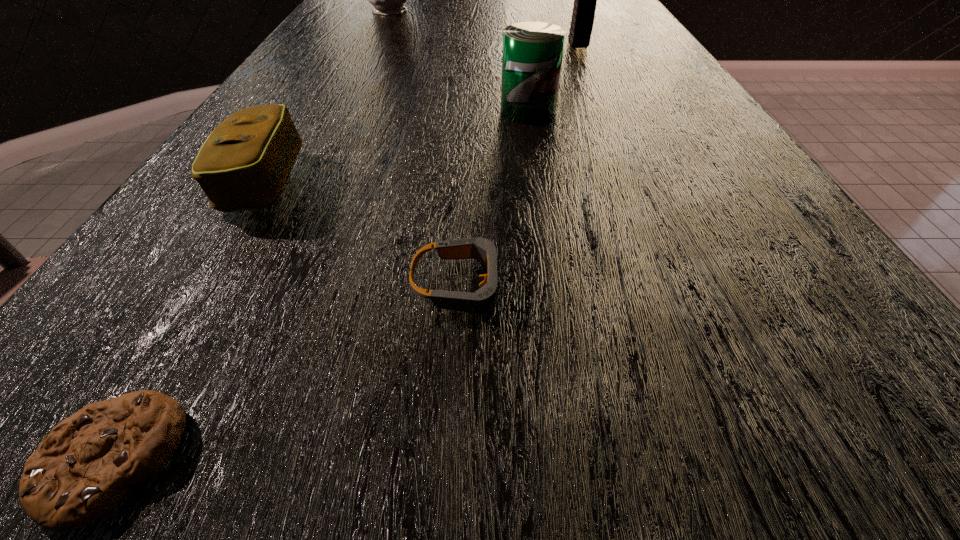
What are the coordinates of `free space between the shorter clutch bag and the rightmost object` in the screenshot? It's located at (421, 113).

Choose which object is the fifth nearest neighbor to the goggles. Please provide its 2D coordinates. Your answer should be formatted as a tuple, i.e. [(x, y)], where the tuple contains the x and y coordinates of a point satisfying the conditions above.

[(387, 0)]

Image resolution: width=960 pixels, height=540 pixels. I want to click on the second closest object to the second nearest object, so pos(244,164).

Where is `free space that satisfies the following two spatial constraints: 1. on the front side of the second object from right to left; 2. on the zipper side of the nearer clutch bag`? The height and width of the screenshot is (540, 960). free space that satisfies the following two spatial constraints: 1. on the front side of the second object from right to left; 2. on the zipper side of the nearer clutch bag is located at coordinates (540, 182).

Image resolution: width=960 pixels, height=540 pixels. What are the coordinates of `free region that satisfies the following two spatial constraints: 1. with the zip open on the rightmost object; 2. on the zipper side of the third nearest object` in the screenshot? It's located at (638, 182).